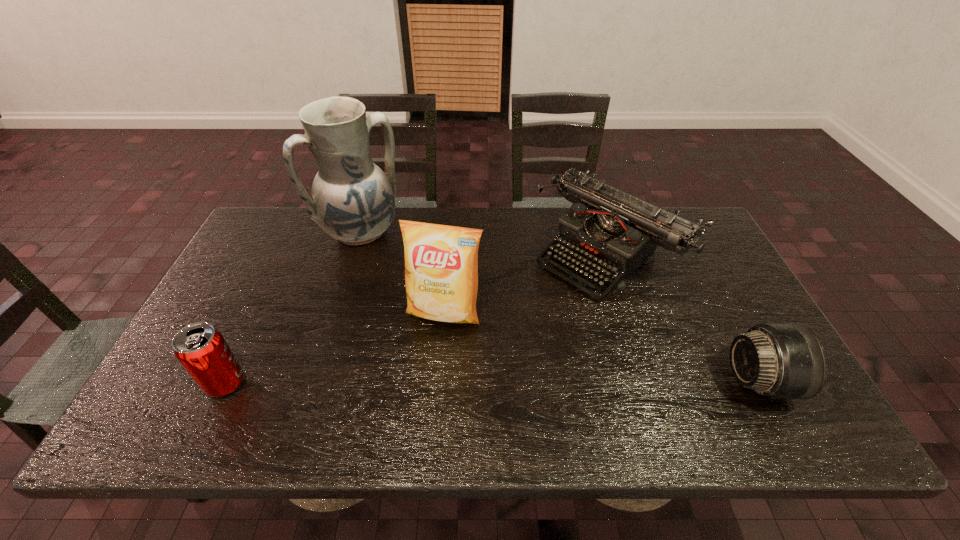
Where is `free spot on the desktop that is between the leftmost object and the telephoto lens and is positioned on the front-facing side of the fourth object from right to left`? free spot on the desktop that is between the leftmost object and the telephoto lens and is positioned on the front-facing side of the fourth object from right to left is located at coordinates (487, 382).

Locate an element on the screen. This screenshot has height=540, width=960. vacant spot on the desktop that is between the soda can and the telephoto lens and is positioned on the keyboard of the typewriter is located at coordinates (463, 382).

Where is `vacant spot on the desktop that is between the soda can and the telephoto lens and is positioned on the front-facing side of the third object from right to left`? vacant spot on the desktop that is between the soda can and the telephoto lens and is positioned on the front-facing side of the third object from right to left is located at coordinates (420, 382).